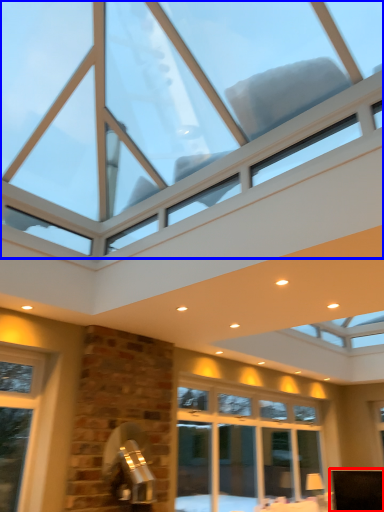
Question: Which point is further to the camera, furniture (highlighted by a red box) or window (highlighted by a blue box)?

Choices:
 (A) furniture
 (B) window

Answer: (A)